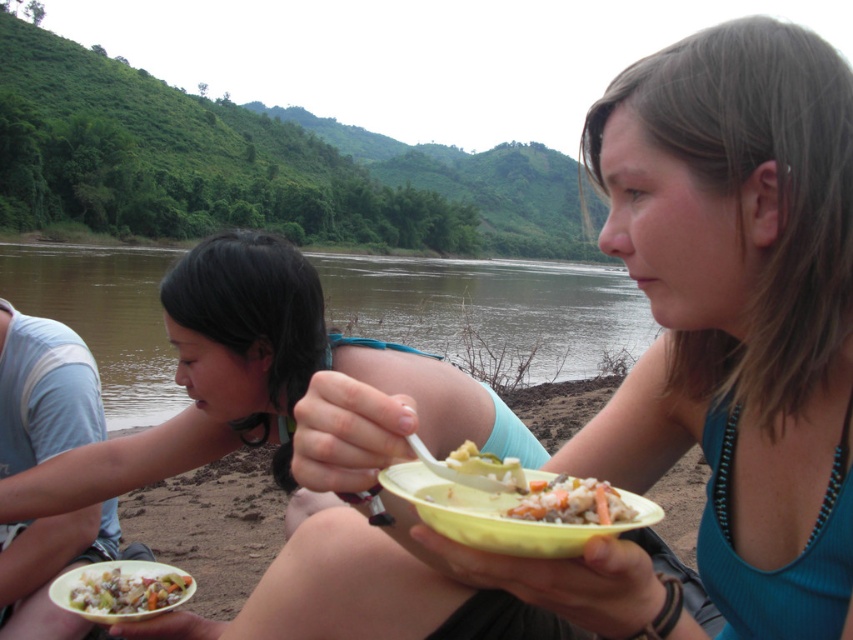
Is matte yellow bowl at center positioned in front of yellow plastic bowl at center?

No, it is behind yellow plastic bowl at center.

Who is taller, matte yellow bowl at center or yellow plastic bowl at center?

matte yellow bowl at center is taller.

Describe the element at coordinates (738, 310) in the screenshot. This screenshot has width=853, height=640. I see `matte yellow bowl at center` at that location.

Locate an element on the screen. The height and width of the screenshot is (640, 853). matte yellow bowl at center is located at coordinates (738, 310).

Who is positioned more to the left, yellow plastic bowl at center or shiny plastic bowl at lower left?

shiny plastic bowl at lower left is more to the left.

Is yellow plastic bowl at center to the right of shiny plastic bowl at lower left from the viewer's perspective?

Yes, yellow plastic bowl at center is to the right of shiny plastic bowl at lower left.

What do you see at coordinates (496, 513) in the screenshot? The width and height of the screenshot is (853, 640). I see `yellow plastic bowl at center` at bounding box center [496, 513].

This screenshot has width=853, height=640. I want to click on yellow plastic bowl at center, so click(x=496, y=513).

Who is more forward, (682, 273) or (102, 605)?

Positioned in front is point (682, 273).

Is point (627, 100) more distant than point (123, 595)?

No, (627, 100) is closer to viewer.

The image size is (853, 640). Identify the location of matte yellow bowl at center. (738, 310).